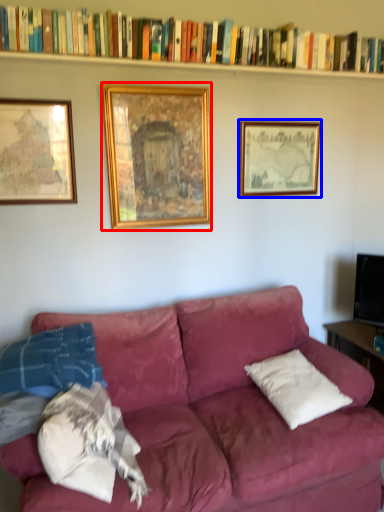
Question: Which point is further to the camera, picture frame (highlighted by a red box) or picture frame (highlighted by a blue box)?

Choices:
 (A) picture frame
 (B) picture frame

Answer: (B)